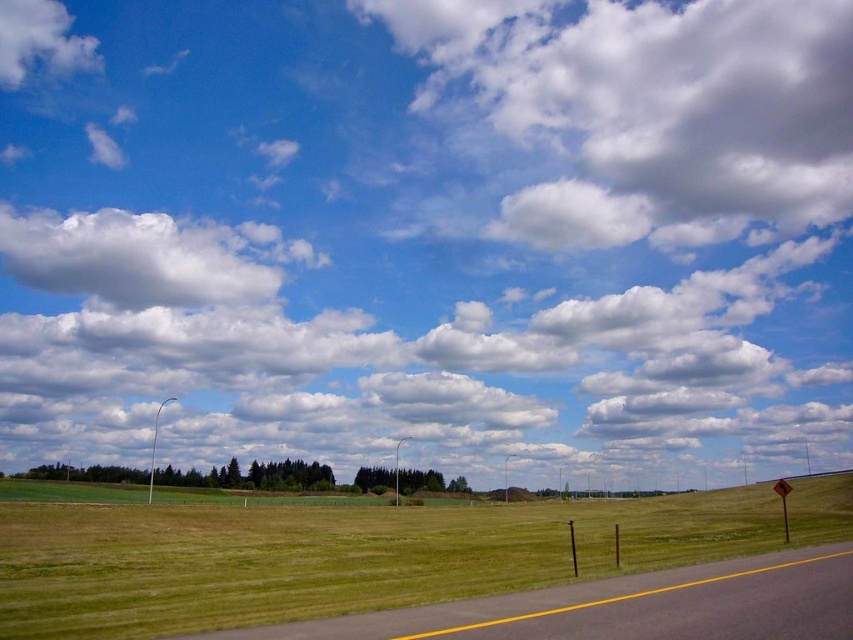
You are an astronomer analyzing the position of celestial objects in the sky. You observe the white fluffy cloud at upper center. What are its coordinates in the image?

The white fluffy cloud at upper center is located at coordinates point (x=653, y=112).

You are an astronomer analyzing the sky in the image. You need to locate the white fluffy cloud at upper center for a study. What are its coordinates?

The white fluffy cloud at upper center is located at point (653, 112).